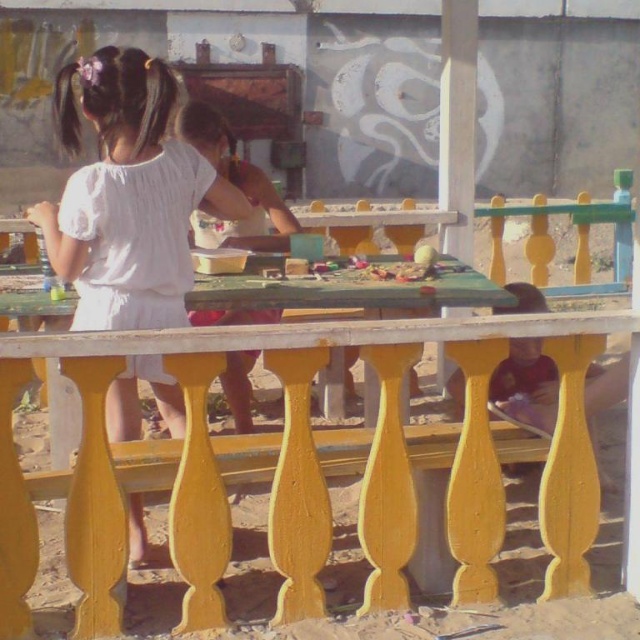
Question: Which point appears closest to the camera in this image?

Choices:
 (A) (72, 353)
 (B) (170, 385)

Answer: (A)

Question: Does white cotton dress at center have a larger size compared to yellow painted wood table at center?

Choices:
 (A) no
 (B) yes

Answer: (A)

Question: Is white cotton dress at center to the right of yellow painted wood table at center from the viewer's perspective?

Choices:
 (A) yes
 (B) no

Answer: (B)

Question: Can you confirm if white cotton dress at center is wider than yellow painted wood table at center?

Choices:
 (A) no
 (B) yes

Answer: (A)

Question: Which of the following is the closest to the observer?

Choices:
 (A) yellow painted wood table at center
 (B) white cotton dress at center

Answer: (A)

Question: Which point is closer to the camera taking this photo?

Choices:
 (A) (577, 330)
 (B) (100, 164)

Answer: (B)